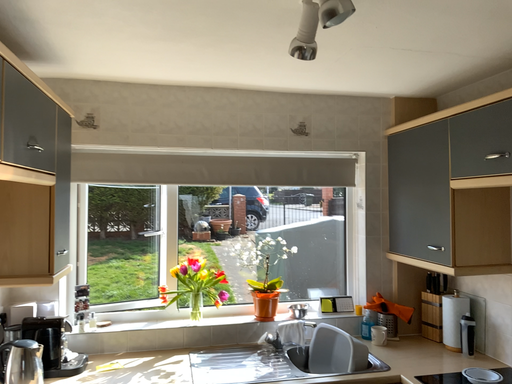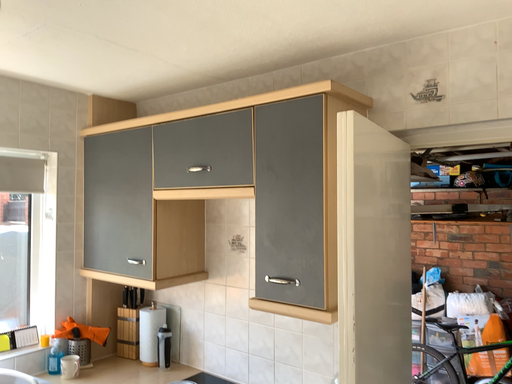
Question: Which way did the camera rotate in the video?

Choices:
 (A) rotated left
 (B) rotated right

Answer: (B)